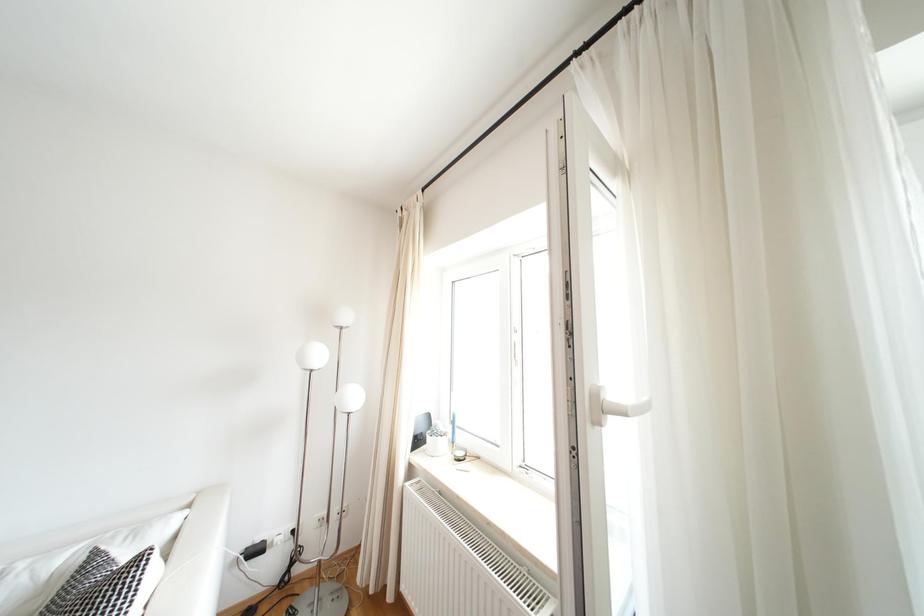
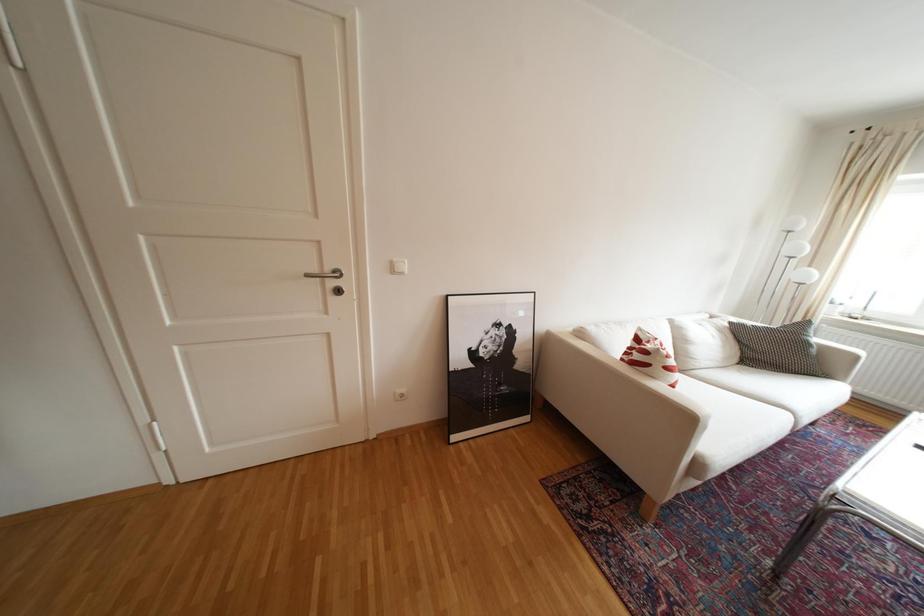
What movement of the cameraman would produce the second image?

The movement direction of the cameraman is left, backward.